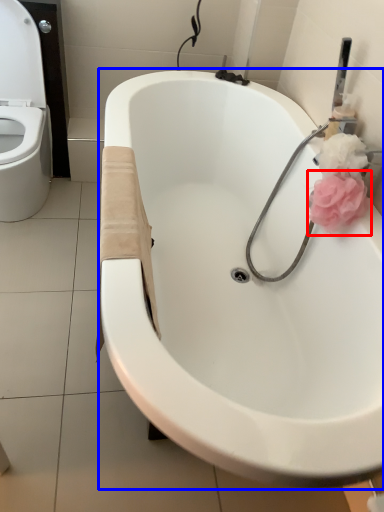
Question: Which object appears farthest to the camera in this image, rose (highlighted by a red box) or bathtub (highlighted by a blue box)?

Choices:
 (A) rose
 (B) bathtub

Answer: (A)